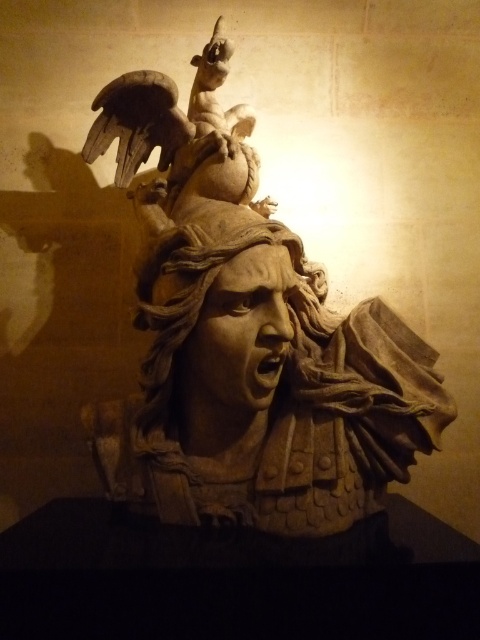
Does point (278, 444) come closer to viewer compared to point (313, 276)?

Yes.

Does stone sculpture at center appear over carved stone head at center?

Yes, stone sculpture at center is above carved stone head at center.

Who is more forward, (199, 433) or (308, 340)?

Positioned in front is point (199, 433).

At what (x,y) coordinates should I click in order to perform the action: click on stone sculpture at center. Please return your answer as a coordinate pair (x, y). This screenshot has width=480, height=640. Looking at the image, I should click on pos(245,339).